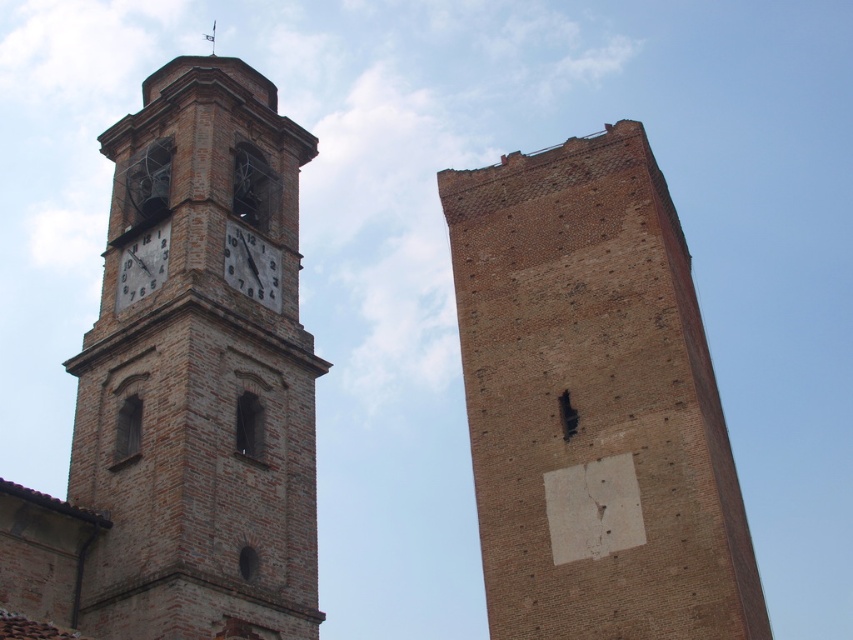
Is brown brick tower at center positioned at the back of matte brick clock at upper left?

No, it is in front of matte brick clock at upper left.

Between brown brick tower at center and matte brick clock at upper left, which one has less height?

matte brick clock at upper left

This screenshot has width=853, height=640. I want to click on brown brick tower at center, so click(593, 403).

The width and height of the screenshot is (853, 640). I want to click on brown brick tower at center, so click(x=593, y=403).

Is matte brick clock at center to the right of matte brick clock at upper left from the viewer's perspective?

Correct, you'll find matte brick clock at center to the right of matte brick clock at upper left.

Who is higher up, matte brick clock at center or matte brick clock at upper left?

Answer: matte brick clock at center is higher up.

Who is more distant from viewer, (241, 256) or (155, 243)?

The point (155, 243) is more distant.

At what (x,y) coordinates should I click in order to perform the action: click on matte brick clock at center. Please return your answer as a coordinate pair (x, y). The height and width of the screenshot is (640, 853). Looking at the image, I should click on [x=252, y=266].

Who is positioned more to the right, brown brick tower at center or brown brick clock tower at left?

brown brick tower at center is more to the right.

In the scene shown: Can you confirm if brown brick tower at center is bigger than brown brick clock tower at left?

No, brown brick tower at center is not bigger than brown brick clock tower at left.

You are a GUI agent. You are given a task and a screenshot of the screen. Output one action in this format:
    pyautogui.click(x=<x>, y=<y>)
    Task: Click on the brown brick tower at center
    The image size is (853, 640).
    Given the screenshot: What is the action you would take?
    pyautogui.click(x=593, y=403)